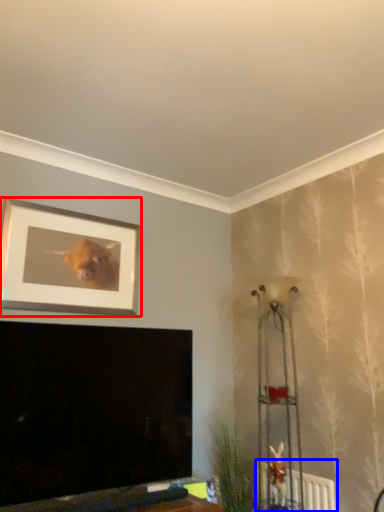
Question: Among these objects, which one is farthest to the camera, picture frame (highlighted by a red box) or radiator (highlighted by a blue box)?

Choices:
 (A) picture frame
 (B) radiator

Answer: (A)